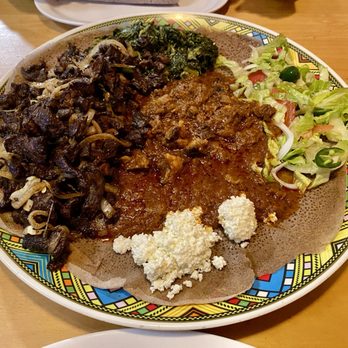
This screenshot has height=348, width=348. In order to click on table in this screenshot , I will do `click(309, 333)`.